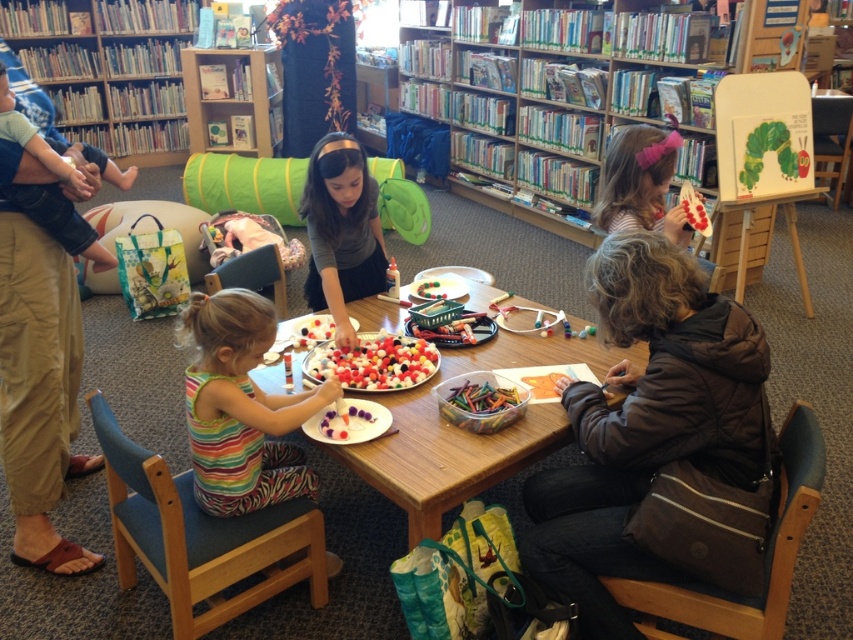
Question: Which point is closer to the camera taking this photo?

Choices:
 (A) (380, 378)
 (B) (416, 288)

Answer: (A)

Question: Can you confirm if white glossy beads at center is positioned to the left of white fluffy cotton balls at center?

Choices:
 (A) yes
 (B) no

Answer: (B)

Question: Which object is the farthest from the matte gray shirt at center?

Choices:
 (A) brown cotton pants at left
 (B) striped fabric dress at lower left

Answer: (A)

Question: Considering the real-world distances, which object is farthest from the matte pink hairband at upper right?

Choices:
 (A) smooth white beads at center
 (B) white fluffy cotton balls at center

Answer: (B)

Question: Can you confirm if wooden bookshelf at upper center is positioned above striped fabric dress at lower left?

Choices:
 (A) yes
 (B) no

Answer: (A)

Question: Does brown cotton pants at left lie behind white fluffy cotton balls at center?

Choices:
 (A) yes
 (B) no

Answer: (B)